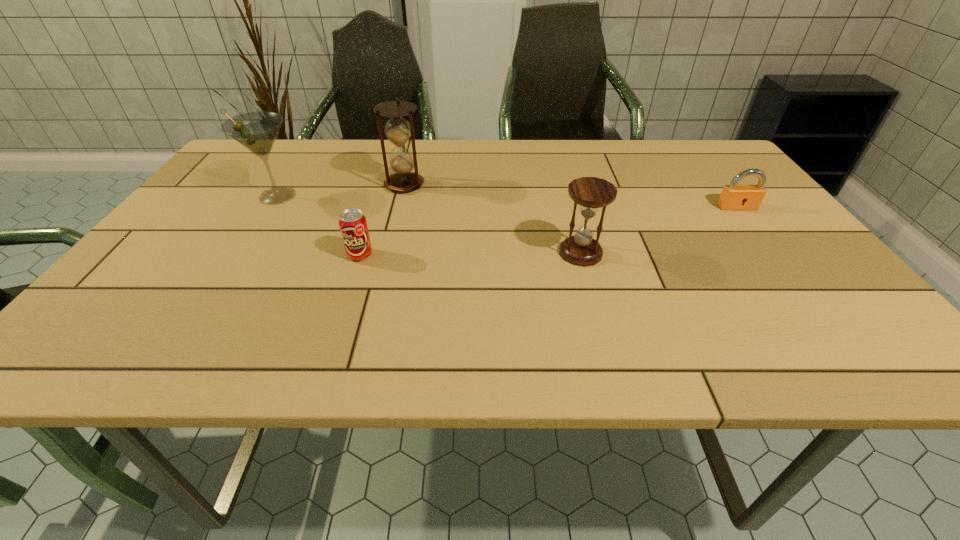
Image resolution: width=960 pixels, height=540 pixels. I want to click on vacant area situated 0.400m to unlock the padlock from the front, so click(836, 333).

The image size is (960, 540). I want to click on vacant space located on the right of the soda, so click(468, 255).

Locate an element on the screen. The image size is (960, 540). object that is at the far edge is located at coordinates (398, 130).

What are the coordinates of `object at the left edge` in the screenshot? It's located at 257,131.

The width and height of the screenshot is (960, 540). In order to click on object present at the right edge in this screenshot , I will do `click(733, 197)`.

Locate an element on the screen. The image size is (960, 540). vacant area at the far edge of the desktop is located at coordinates (569, 156).

This screenshot has width=960, height=540. What are the coordinates of `free region at the near edge of the desktop` in the screenshot? It's located at (698, 353).

Locate an element on the screen. Image resolution: width=960 pixels, height=540 pixels. vacant space at the left edge of the desktop is located at coordinates (101, 314).

The image size is (960, 540). What are the coordinates of `free location at the right edge of the desktop` in the screenshot? It's located at (756, 259).

Where is `vacant space at the far left corner of the desktop`? vacant space at the far left corner of the desktop is located at coordinates (236, 172).